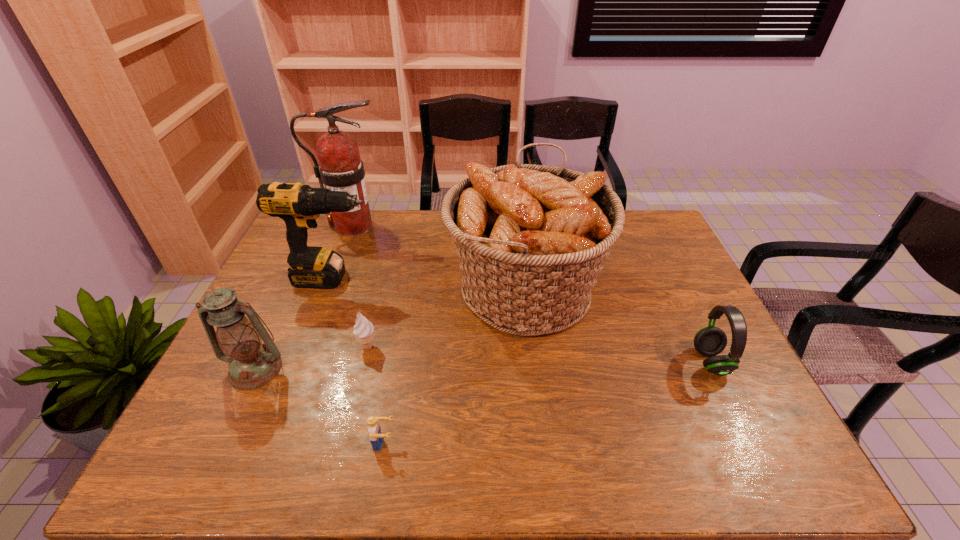
I want to click on vacant space located 0.160m at the nozzle of the farthest object, so click(x=433, y=226).

Where is `blank space located 0.090m on the right of the basket`? blank space located 0.090m on the right of the basket is located at coordinates (632, 288).

Identify the location of vacant space located 0.210m at the tip of the drill. (444, 278).

Where is `free space located on the right of the oil lamp`? The width and height of the screenshot is (960, 540). free space located on the right of the oil lamp is located at coordinates (392, 369).

You are a GUI agent. You are given a task and a screenshot of the screen. Output one action in this format:
    pyautogui.click(x=<x>, y=<y>)
    Task: Click on the free space located on the ear cups of the headset
    This screenshot has width=960, height=540.
    Given the screenshot: What is the action you would take?
    (649, 361)

This screenshot has height=540, width=960. Identify the location of free spot located 0.290m on the ear cups of the headset. (584, 361).

This screenshot has height=540, width=960. I want to click on free space located on the ear cups of the headset, so click(x=614, y=361).

At what (x,y) coordinates should I click in order to perform the action: click on free space located 0.310m on the front-facing side of the icecream. Please return your answer as a coordinate pair (x, y). Looking at the image, I should click on (338, 469).

Locate an element on the screen. This screenshot has width=960, height=540. free spot located 0.190m on the face of the Lego is located at coordinates (481, 443).

I want to click on fire extinguisher present at the far edge, so click(340, 168).